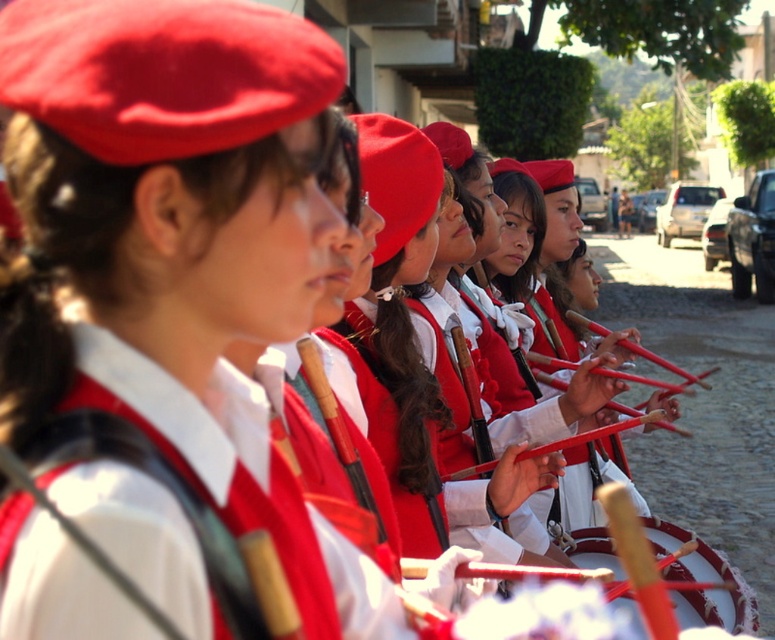
Can you confirm if matte red beret at center is taller than white leather drum at center?

Correct, matte red beret at center is much taller as white leather drum at center.

Is point (558, 472) closer to viewer compared to point (718, 579)?

Yes, point (558, 472) is closer to viewer.

What are the coordinates of `matte red beret at center` in the screenshot? It's located at (415, 339).